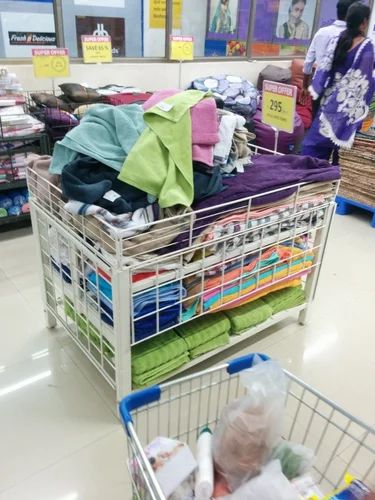
Where is `pile of multicolored pillows`? pile of multicolored pillows is located at coordinates (92, 95).